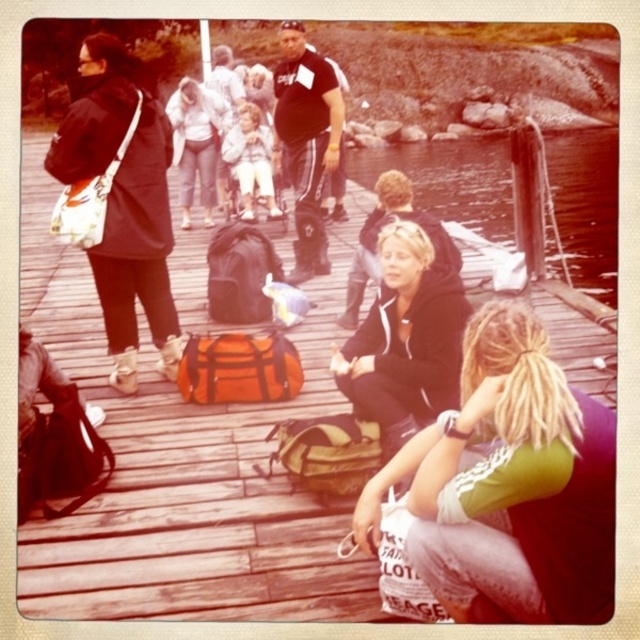
You are standing on the wooden dock and want to hand a gift to the person wearing the green jersey at lower right. Based on their position, where should you walk to find them?

The green jersey at lower right is located at point 0.797 on the x axis and 0.797 on the y axis, so you should walk towards the lower right area of the dock to find them.

You are a photographer standing on the dock. You want to take a photo of the clear water at dock center while also including the matte white shirt at upper center in the frame. Given the distance between them, do you think you can capture both in a single shot without moving your position?

The clear water at dock center and matte white shirt at upper center are 21.38 meters apart. Depending on the camera lens, this distance may require a wide angle to capture both in one frame without moving.